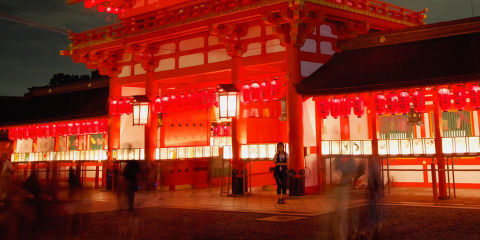
Identify the location of entrance. Image resolution: width=480 pixels, height=240 pixels. (220, 175).